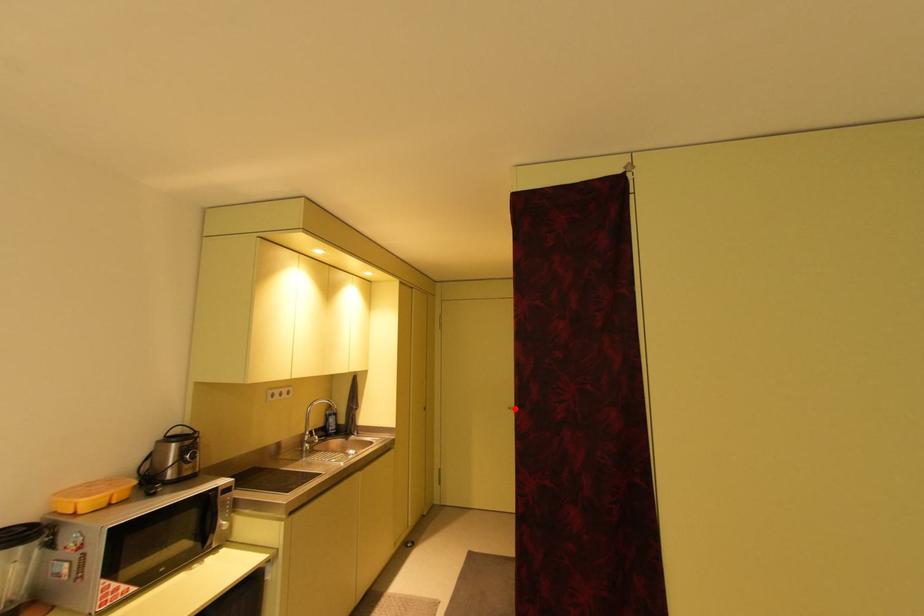
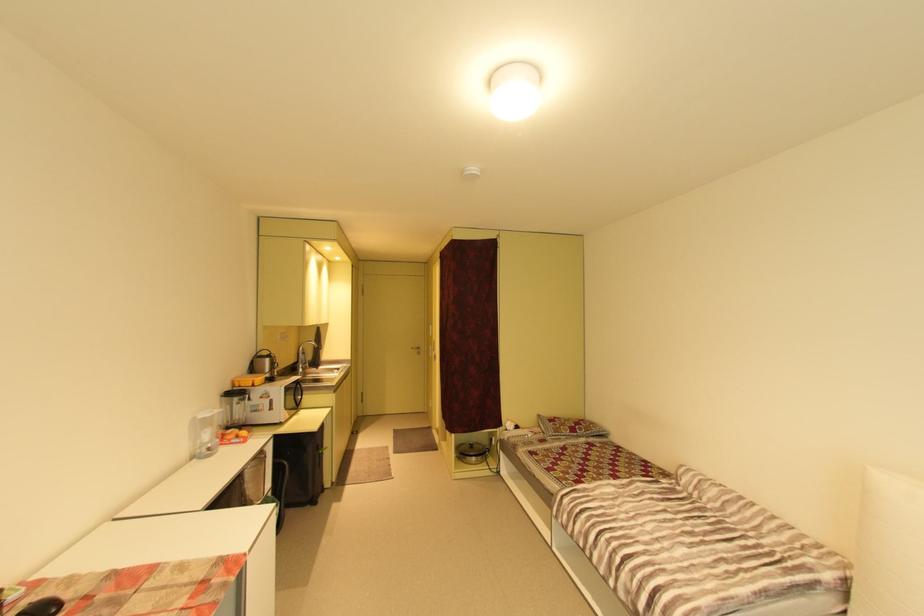
Question: I am providing you with two images of the same scene from different viewpoints. Image1 has a red point marked. In image2, the corresponding 3D location appears at what relative position? Reply with the corresponding letter.

Choices:
 (A) Closer
 (B) Farther

Answer: (B)